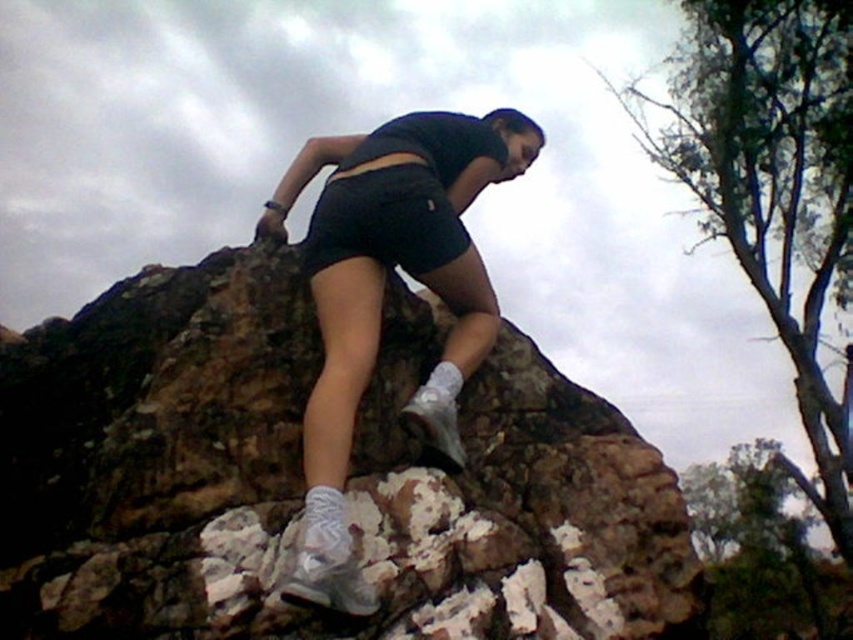
Question: Which point is closer to the camera?

Choices:
 (A) (329, 179)
 (B) (144, 486)
 (C) (456, 307)

Answer: (B)

Question: Where is brown rough rock at center located in relation to white matte sneakers at center in the image?

Choices:
 (A) above
 (B) below

Answer: (B)

Question: Can you confirm if brown rough rock at center is positioned to the right of black matte shorts at center?

Choices:
 (A) no
 (B) yes

Answer: (A)

Question: Which object is the closest to the black matte shorts at center?

Choices:
 (A) brown rough rock at center
 (B) white matte sneakers at center

Answer: (B)

Question: Does white matte sneakers at center lie in front of black matte shorts at center?

Choices:
 (A) no
 (B) yes

Answer: (B)

Question: Among these points, which one is farthest from the camera?

Choices:
 (A) (387, 168)
 (B) (462, 417)

Answer: (A)